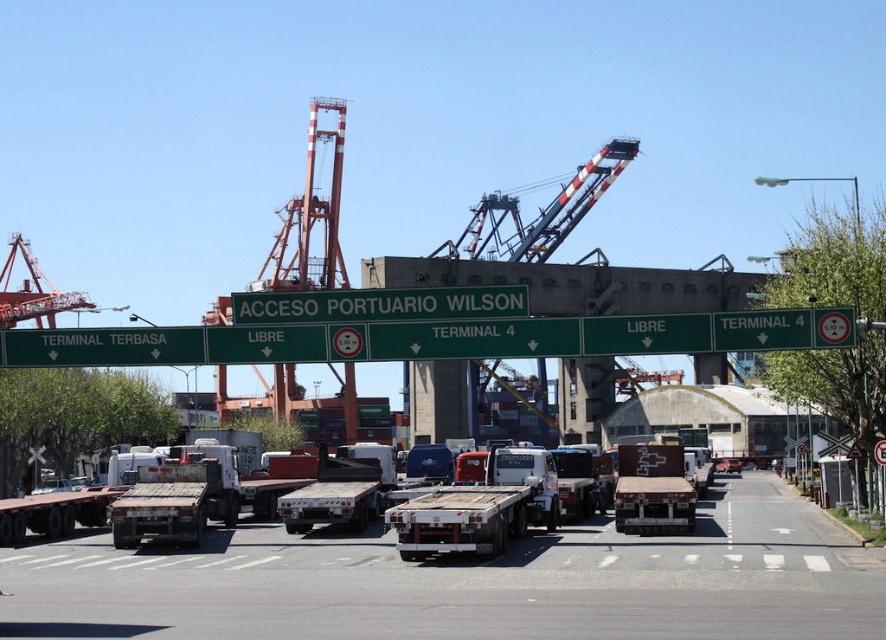
You are a GUI agent. You are given a task and a screenshot of the screen. Output one action in this format:
    pyautogui.click(x=<x>, y=<y>)
    Task: Click on the green metallic signboard at center
    The height and width of the screenshot is (640, 886).
    Given the screenshot: What is the action you would take?
    pyautogui.click(x=378, y=305)

In the scene shown: Is green metallic signboard at center further to camera compared to green metallic signboard at left?

No, it is not.

Who is more forward, (257, 307) or (70, 356)?

Point (257, 307) is in front.

The image size is (886, 640). In order to click on green metallic signboard at center in this screenshot , I will do `click(378, 305)`.

Does green metallic signboard at left have a smaller size compared to green matte sign at center?

Indeed, green metallic signboard at left has a smaller size compared to green matte sign at center.

Does point (82, 362) come farther from viewer compared to point (685, 342)?

Yes, it is behind point (685, 342).

At what (x,y) coordinates should I click in order to perform the action: click on green metallic signboard at left. Please return your answer as a coordinate pair (x, y). Looking at the image, I should click on (102, 346).

Is green metallic signboard at center to the left of metallic flatbed trailer at center from the viewer's perspective?

Yes, green metallic signboard at center is to the left of metallic flatbed trailer at center.

Is green metallic signboard at center bigger than metallic flatbed trailer at center?

Yes, green metallic signboard at center is bigger than metallic flatbed trailer at center.

Does point (416, 289) come farther from viewer compared to point (456, 508)?

Yes, point (416, 289) is behind point (456, 508).

The image size is (886, 640). I want to click on green metallic signboard at center, so click(378, 305).